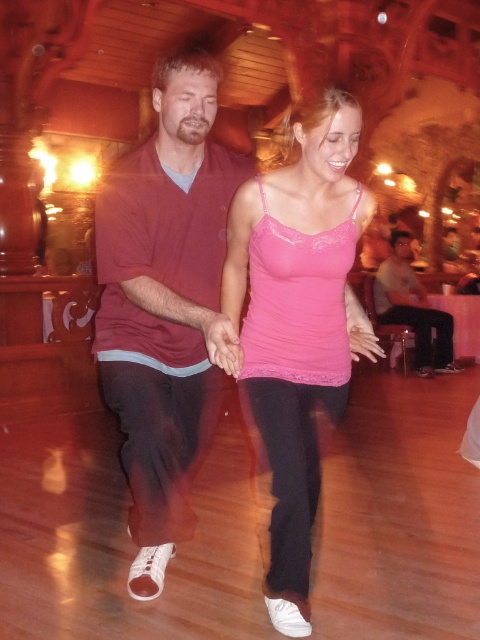
Question: Which object appears farthest from the camera in this image?

Choices:
 (A) pink lace tank top at center
 (B) gray cotton shirt at center

Answer: (B)

Question: Is the position of matte maroon shirt at center more distant than that of pink lace tank top at center?

Choices:
 (A) yes
 (B) no

Answer: (B)

Question: Which point is farther to the camera?

Choices:
 (A) 425,307
 (B) 300,467
 (C) 160,86

Answer: (A)

Question: Is matte maroon shirt at center positioned before pink lace tank top at center?

Choices:
 (A) yes
 (B) no

Answer: (A)

Question: Which is farther from the gray cotton shirt at center?

Choices:
 (A) matte maroon shirt at center
 (B) pink lace tank top at center

Answer: (A)

Question: Can you confirm if matte maroon shirt at center is thinner than gray cotton shirt at center?

Choices:
 (A) no
 (B) yes

Answer: (B)